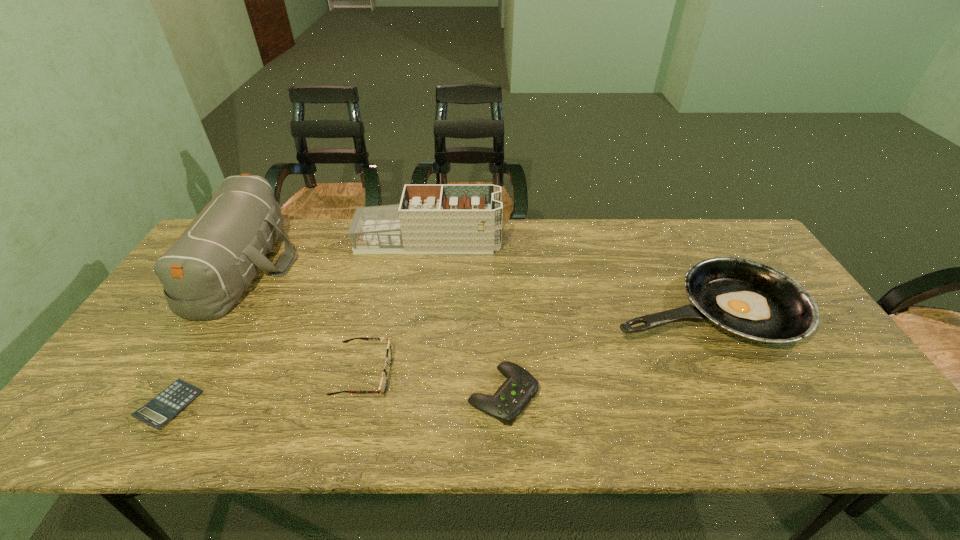
Identify the location of object located in the far left corner section of the desktop. (204, 273).

Find the location of `object that is positioned at the near left corner`. object that is positioned at the near left corner is located at coordinates (165, 406).

At what (x,y) coordinates should I click in order to perform the action: click on vacant space at the far edge of the desktop. Please return your answer as a coordinate pair (x, y). The image size is (960, 540). Looking at the image, I should click on (296, 230).

You are a GUI agent. You are given a task and a screenshot of the screen. Output one action in this format:
    pyautogui.click(x=<x>, y=<y>)
    Task: Click on the free spot at the near edge of the desktop
    
    Given the screenshot: What is the action you would take?
    pyautogui.click(x=376, y=416)

In the image, there is a desktop. What are the coordinates of `vacant space at the left edge` in the screenshot? It's located at (145, 326).

This screenshot has height=540, width=960. I want to click on vacant space at the near left corner of the desktop, so click(x=121, y=417).

Where is `free space at the far right corner of the desktop`? free space at the far right corner of the desktop is located at coordinates (737, 228).

Find the location of a particular element. free space at the near right corner of the desktop is located at coordinates (866, 408).

At what (x,y) coordinates should I click in order to perform the action: click on blank region between the third tallest object and the calculator. Please return your answer as a coordinate pair (x, y). This screenshot has height=540, width=960. Looking at the image, I should click on (437, 357).

At what (x,y) coordinates should I click in order to perform the action: click on free spot between the calculator and the third shortest object. Please return your answer as a coordinate pair (x, y). This screenshot has width=960, height=540. Looking at the image, I should click on (267, 390).